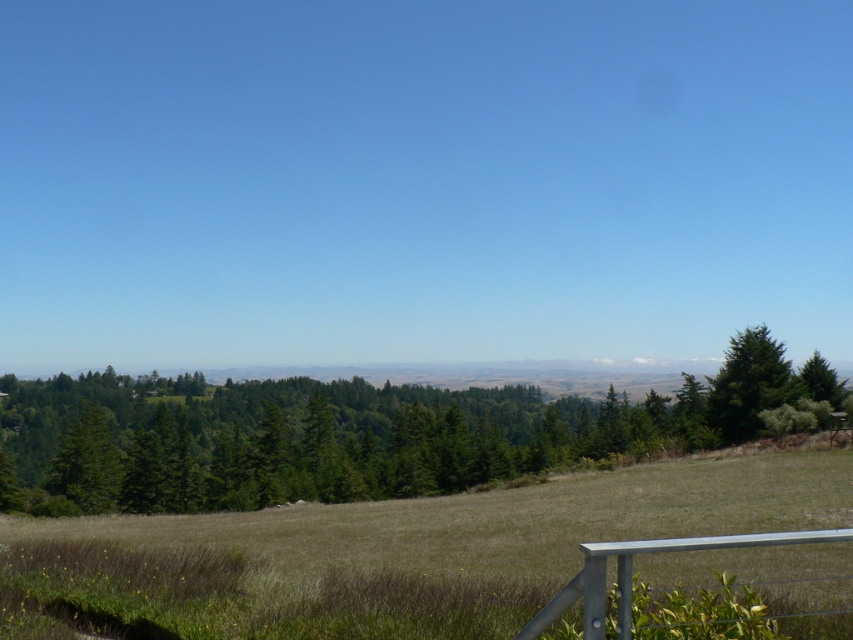
You are a gardener planning to mow the brown dry grass at center and trim the green textured tree at right. Which area requires a wider path for your equipment?

The brown dry grass at center requires a wider path for your equipment because its width is larger than the green textured tree at right.

Consider the image. You are a gardener planning to mow the brown dry grass at center and trim the green textured tree at right. Based on their heights, which task requires a taller ladder?

The brown dry grass at center is taller than the green textured tree at right, so you would need a taller ladder for mowing the brown dry grass at center compared to trimming the green textured tree at right.